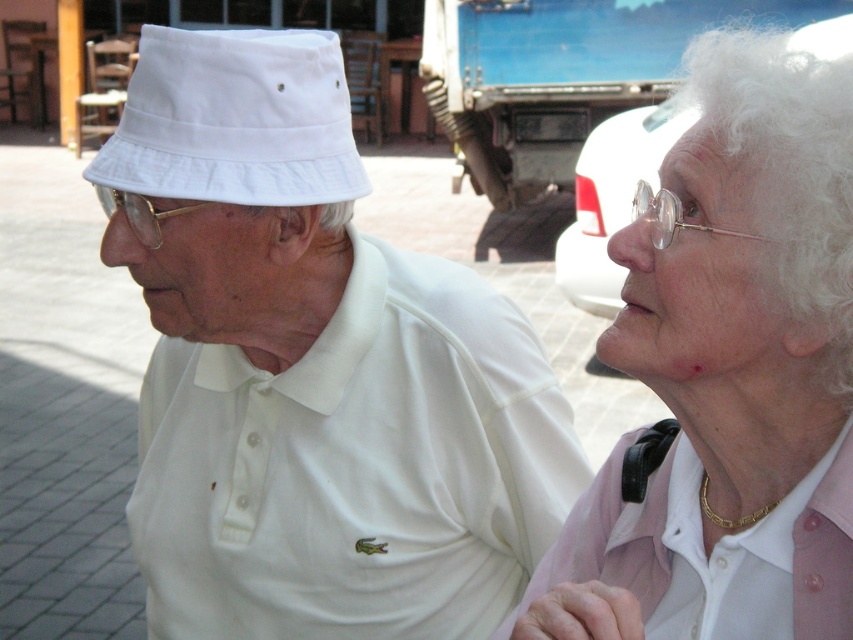
You are a photographer trying to capture a photo of both individuals in the scene. You notice two points marked in the image. One is at coordinate point (454, 381) and the other at point (844, 602). Which point should you stand behind to ensure both people are fully visible in your frame?

You should stand behind point (844, 602) because point (454, 381) is behind it, so standing behind the latter would block the view of the person at point (454, 381).